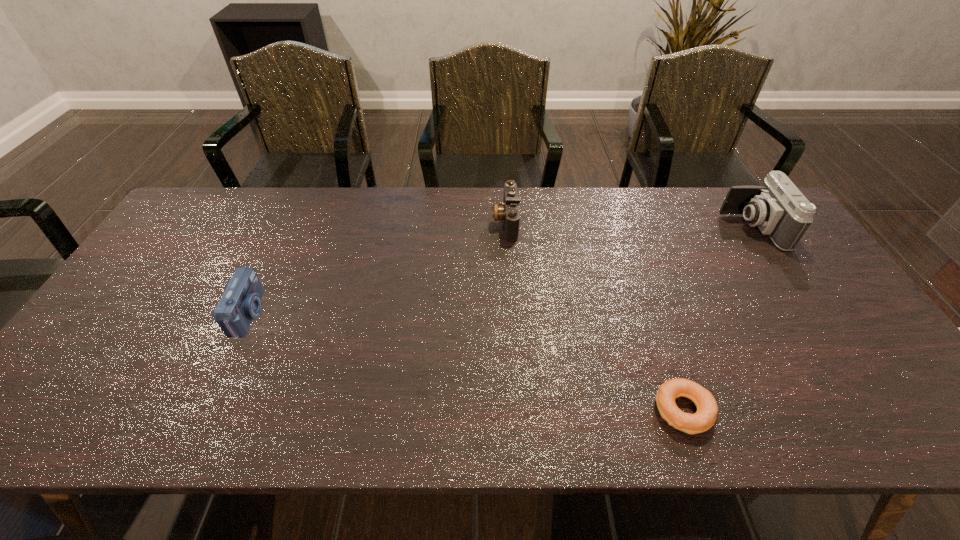
Identify the location of vacant space that satisfies the following two spatial constraints: 1. on the front-facing side of the second object from left to right; 2. on the right side of the third object from left to right. (517, 410).

The image size is (960, 540). Find the location of `free location that satisfies the following two spatial constraints: 1. on the front-facing side of the third object from right to left; 2. on the right side of the nearest object`. free location that satisfies the following two spatial constraints: 1. on the front-facing side of the third object from right to left; 2. on the right side of the nearest object is located at coordinates (517, 410).